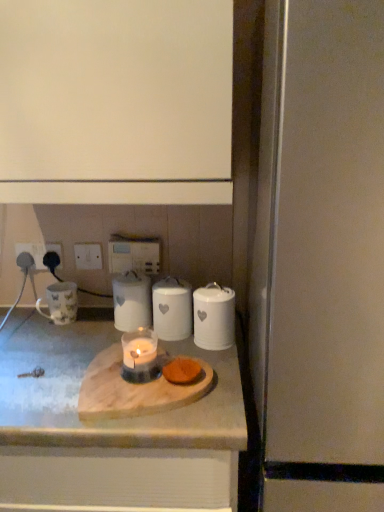
Identify the location of vacant area located to the right-hand side of orange sponge at center. (221, 383).